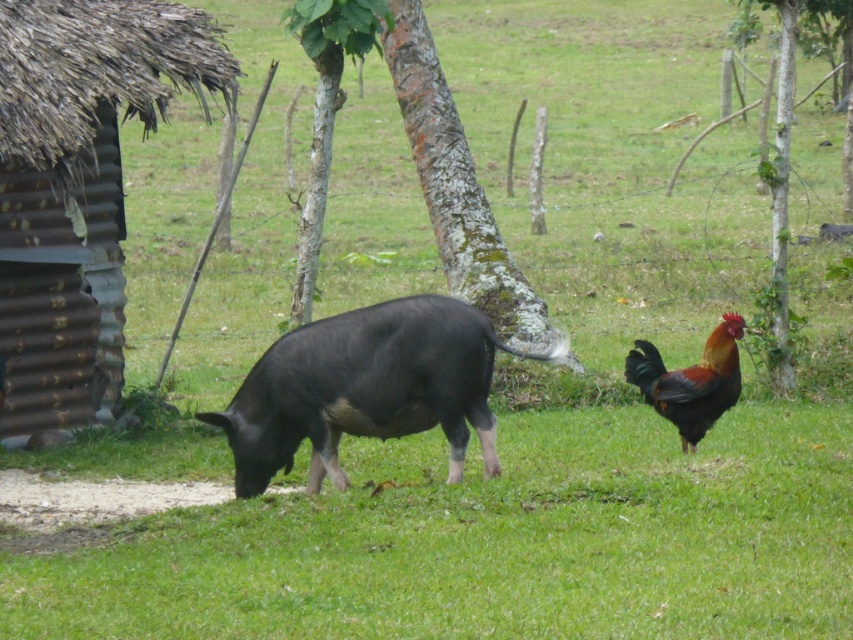
Is green rough bark tree at center closer to camera compared to green bark tree at center?

No.

Describe the element at coordinates (457, 188) in the screenshot. This screenshot has height=640, width=853. I see `green rough bark tree at center` at that location.

At what (x,y) coordinates should I click in order to perform the action: click on green rough bark tree at center. Please return your answer as a coordinate pair (x, y). The image size is (853, 640). Looking at the image, I should click on (457, 188).

Does black matte pig at center have a lesser height compared to green bark tree at right?

Indeed, black matte pig at center has a lesser height compared to green bark tree at right.

Consider the image. Is black matte pig at center bigger than green bark tree at right?

Actually, black matte pig at center might be smaller than green bark tree at right.

What do you see at coordinates (366, 388) in the screenshot? I see `black matte pig at center` at bounding box center [366, 388].

Locate an element on the screen. This screenshot has height=640, width=853. black matte pig at center is located at coordinates (366, 388).

Between green bark tree at center and shiny brown rooster at right, which one has more height?

green bark tree at center

Between point (322, 180) and point (729, 340), which one is positioned behind?

Positioned behind is point (322, 180).

I want to click on green bark tree at center, so click(x=326, y=109).